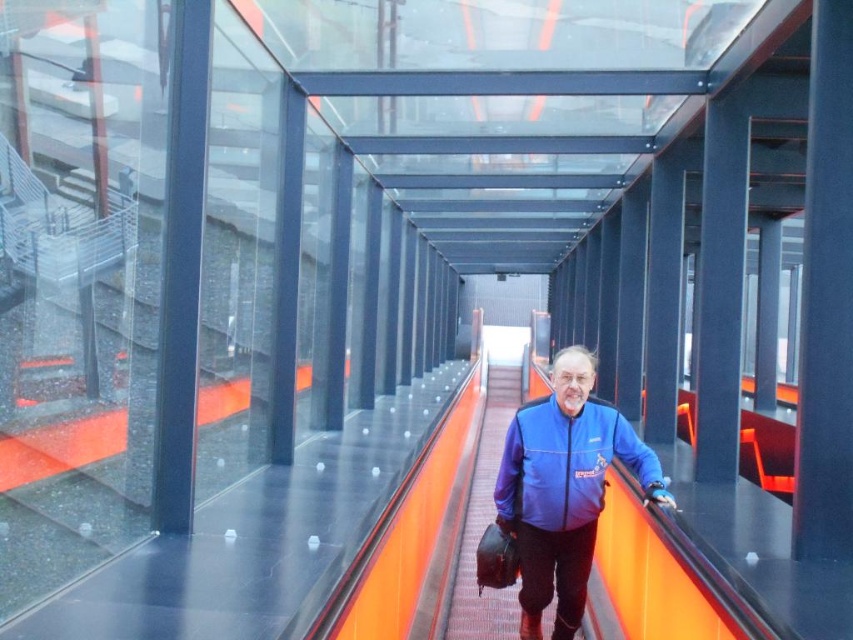
You are a store employee who needs to arrange two jackets for display. You have a blue fabric jacket at center and a blue fleece jacket at center. The store requires that jackets must be placed at least 4 inches apart for visibility. Can you place them according to the requirement?

The distance between the blue fabric jacket at center and the blue fleece jacket at center is 3.36 inches, which is less than the required 4 inches. Therefore, they cannot be placed as per the store requirement without moving them further apart.

You are standing on the escalator and see two jackets hanging from the orange railings at the center. Which jacket is nearer to you, the blue fabric jacket at center or the blue fleece jacket at center?

The blue fabric jacket at center is closer to the viewer than the blue fleece jacket at center, so the blue fabric jacket at center is nearer to you.

You are a store employee who just received a delivery of two jackets. You need to hang them on a rack. The rack has a limited space, and you can only hang one jacket at a time. You see the blue fabric jacket at center and the blue fleece jacket at center in the image. Which jacket should you hang first to ensure both can fit on the rack?

The blue fabric jacket at center is positioned under the blue fleece jacket at center in the image, so you should hang the blue fleece jacket at center first to make space for the blue fabric jacket at center.